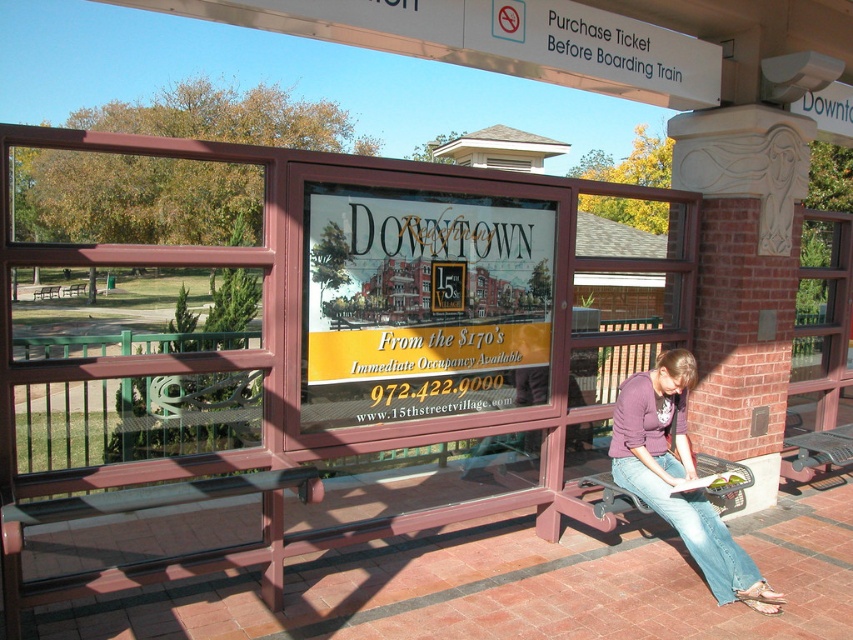
Question: Does purple soft sweater at lower right appear over metallic gray bench at lower right?

Choices:
 (A) yes
 (B) no

Answer: (A)

Question: Does purple soft sweater at lower right have a lesser width compared to metallic gray bench at lower right?

Choices:
 (A) no
 (B) yes

Answer: (B)

Question: Which object is farther from the camera taking this photo?

Choices:
 (A) purple soft sweater at lower right
 (B) metallic gray bench at lower right

Answer: (B)

Question: Which point is farther from the camera taking this photo?

Choices:
 (A) (642, 406)
 (B) (837, 433)

Answer: (B)

Question: Can you confirm if purple soft sweater at lower right is positioned above metallic gray bench at lower right?

Choices:
 (A) yes
 (B) no

Answer: (A)

Question: Which object appears farthest from the camera in this image?

Choices:
 (A) metallic gray bench at lower right
 (B) purple soft sweater at lower right

Answer: (A)